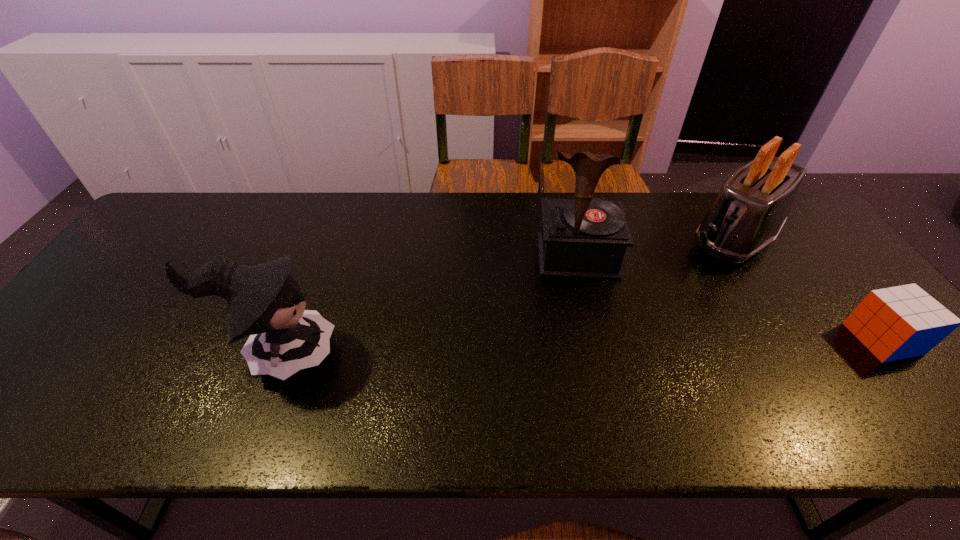
The image size is (960, 540). I want to click on free space on the desktop that is between the doll and the cube and is positioned at the horn opening of the phonograph_record, so click(x=589, y=346).

Locate an element on the screen. This screenshot has width=960, height=540. free space on the desktop that is between the doll and the shortest object and is positioned on the side of the toaster with the control lever is located at coordinates (621, 345).